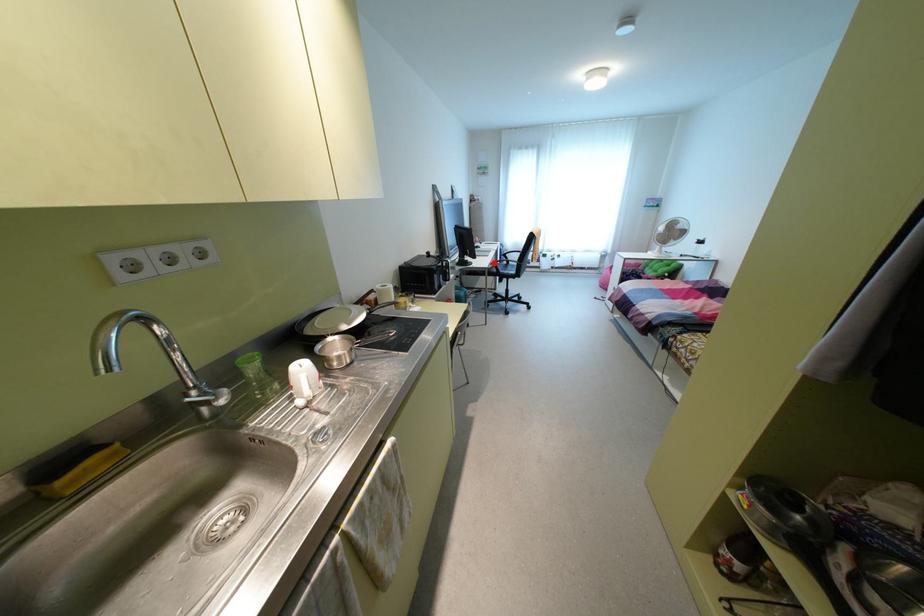
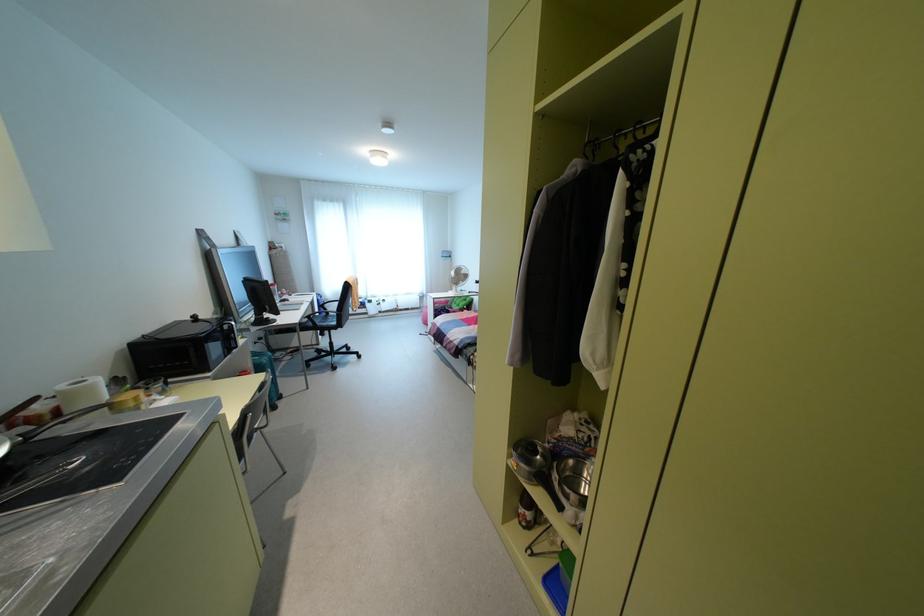
Find the pixel in the second image that matches the highlighted location in the first image.

(309, 315)